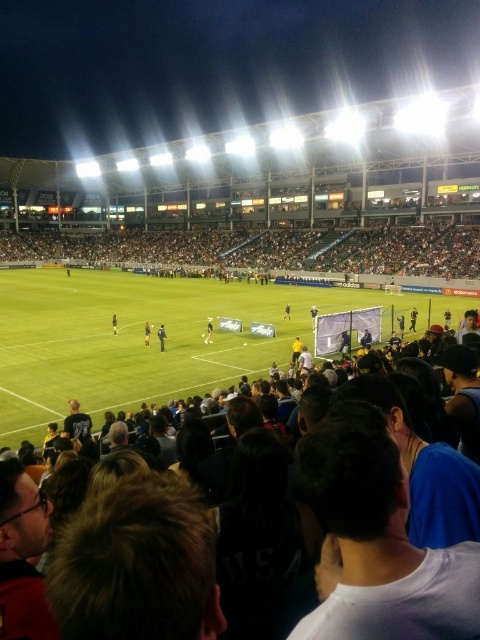
You are a photographer standing at the camera position. You want to capture a closeup shot of the black jersey at center. Given that your camera has a maximum zoom range of 30 meters, will you be able to take the photo?

The black jersey at center and camera are 32.40 meters apart from each other. Since the distance exceeds the camera maximum zoom range of 30 meters, you cannot take the photo.

You are a photographer positioned at the edge of the field. You want to take a photo that includes both the green grass football field at center and the black jersey at center. Which object will appear larger in your photo?

The green grass football field at center will appear larger in the photo because it is closer to the viewer than the black jersey at center.

You are a drone operator trying to capture a birdseye view of the soccer match. The stadium has a restricted airspace zone that prohibits drones from entering an area within 10 meters of the green grass football field at center. If your drone is currently at coordinates 0.5, 0.3, can you legally operate it there?

The green grass football field at center is located at point (152, 339). The drone is at (144, 320). To determine if it is within 10 meters, we calculate the distance between these points. The distance is sqrt of squared differences in x and y coordinates. The difference in x is 0.03, and in y is 0.017. Squared differences are 0.0009 and 0.000289. Sum is 0.001189. Square root is approximately 0.0344. Since 0.0344 is less than 0.10 meters, the drone is within the restricted zone and cannot operate there.